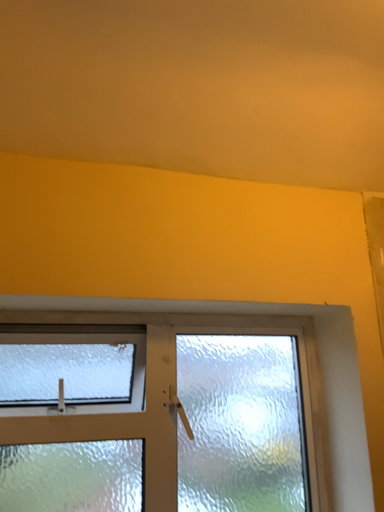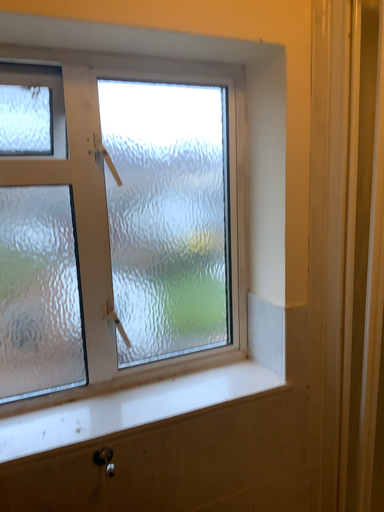
Question: Which way did the camera rotate in the video?

Choices:
 (A) rotated right
 (B) rotated left

Answer: (A)